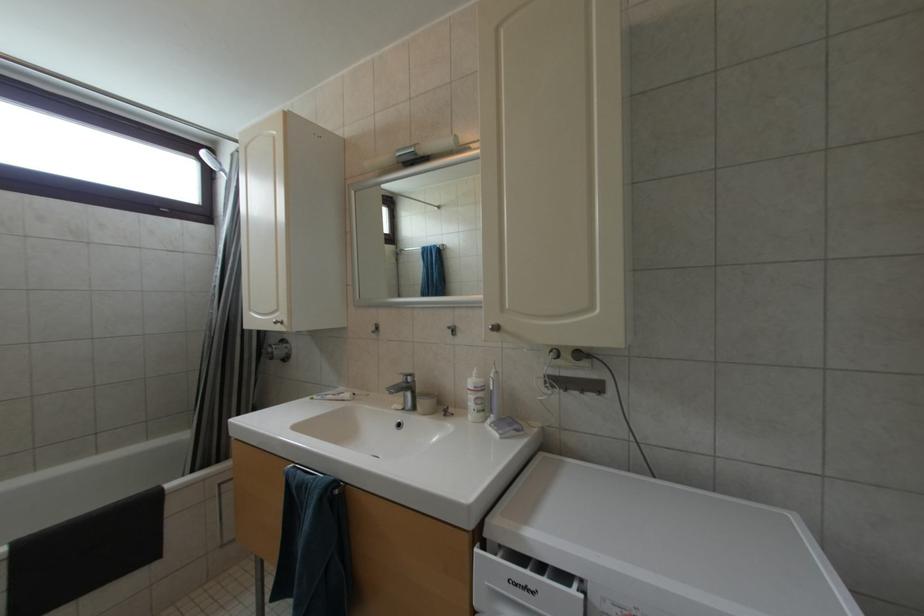
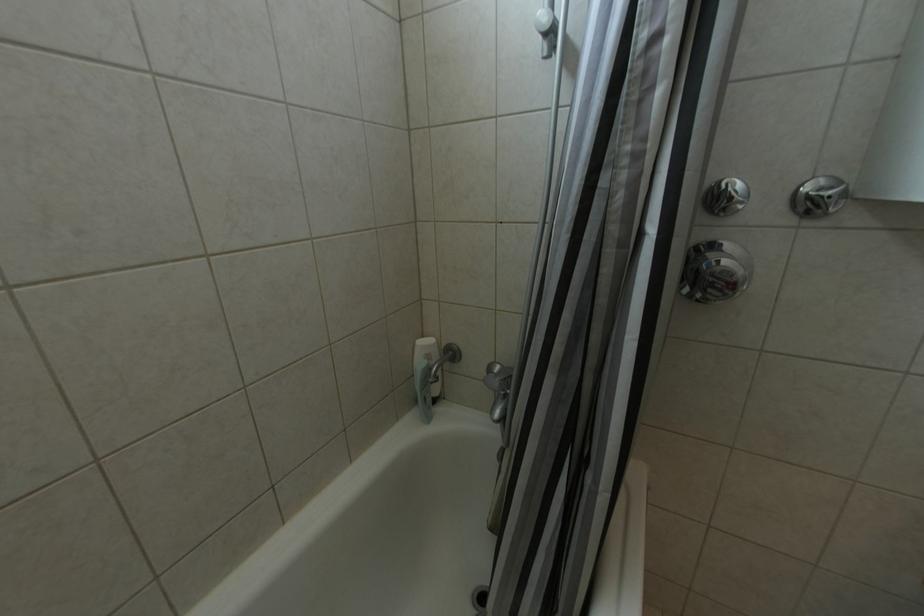
Which direction would the cameraman need to move to produce the second image?

The cameraman walked toward left, forward.